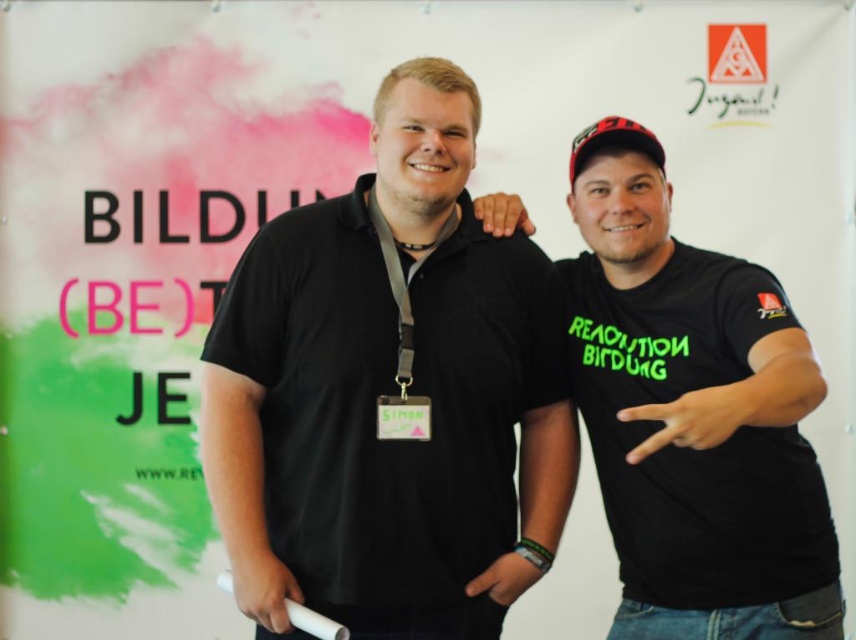
Can you confirm if black matte shirt at center is bigger than black matte t-shirt at right?

No.

Is point (370, 301) positioned after point (690, 490)?

No, (370, 301) is in front of (690, 490).

Is point (521, 292) positioned in front of point (700, 460)?

No, (521, 292) is behind (700, 460).

I want to click on black matte shirt at center, so click(x=390, y=394).

Is black matte t-shirt at right behind white plastic game controller at lower center?

No, it is in front of white plastic game controller at lower center.

Between point (837, 570) and point (312, 627), which one is positioned in front?

Point (312, 627) is more forward.

Where is `black matte t-shirt at right`? The image size is (856, 640). black matte t-shirt at right is located at coordinates (693, 413).

Can you confirm if black matte shirt at center is positioned above white plastic game controller at lower center?

Correct, black matte shirt at center is located above white plastic game controller at lower center.

I want to click on black matte shirt at center, so click(390, 394).

Which is behind, point (397, 200) or point (321, 637)?

The point (397, 200) is more distant.

I want to click on black matte shirt at center, so [x=390, y=394].